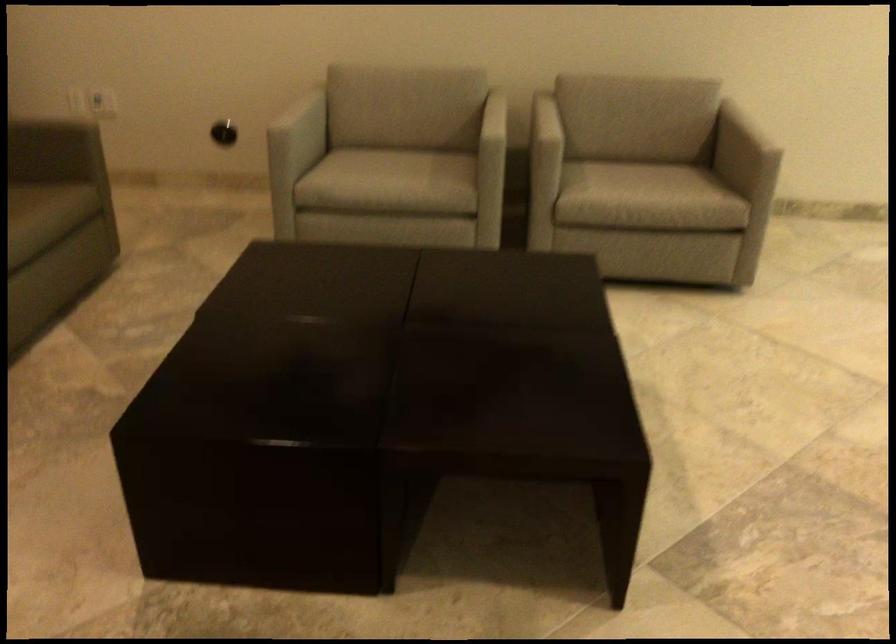
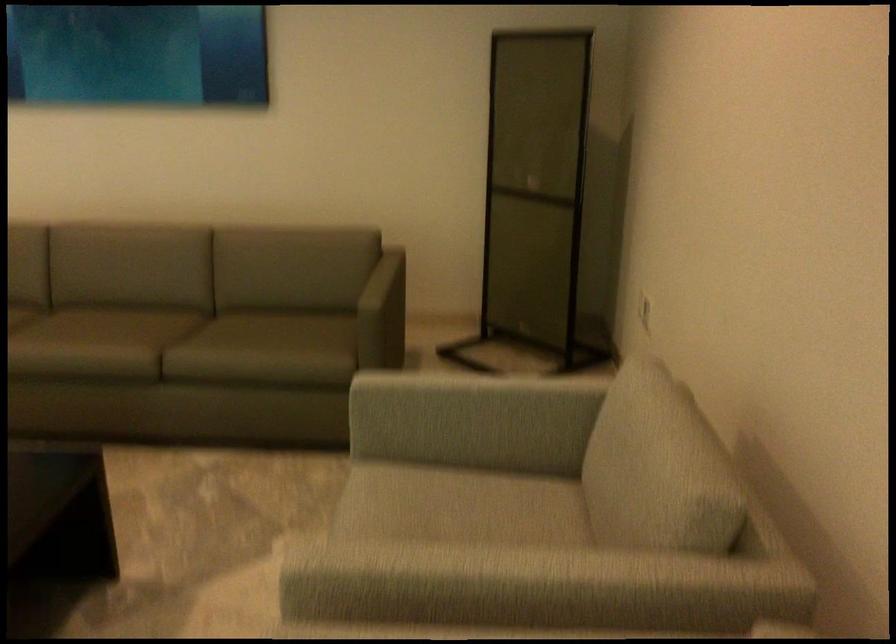
Find the pixel in the second image that matches [332,160] in the first image.

(455, 491)